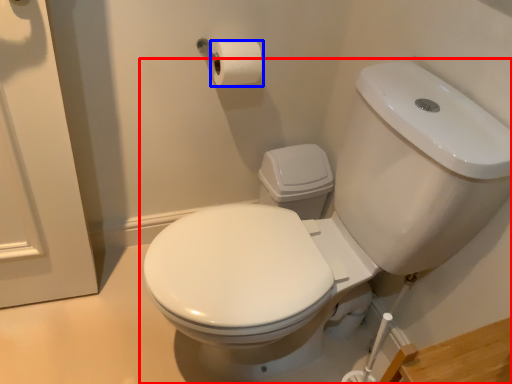
Question: Which object appears farthest to the camera in this image, toilet (highlighted by a red box) or toilet paper (highlighted by a blue box)?

Choices:
 (A) toilet
 (B) toilet paper

Answer: (B)